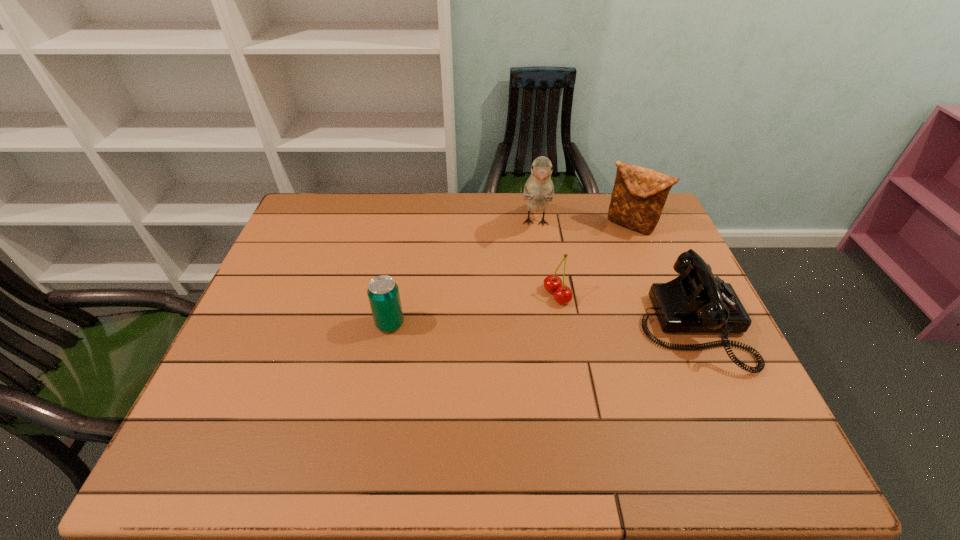
Find the location of a particular element. Image resolution: width=960 pixels, height=540 pixels. vacant point that satisfies the following two spatial constraints: 1. on the back side of the leftmost object; 2. on the right side of the tallest object is located at coordinates (409, 224).